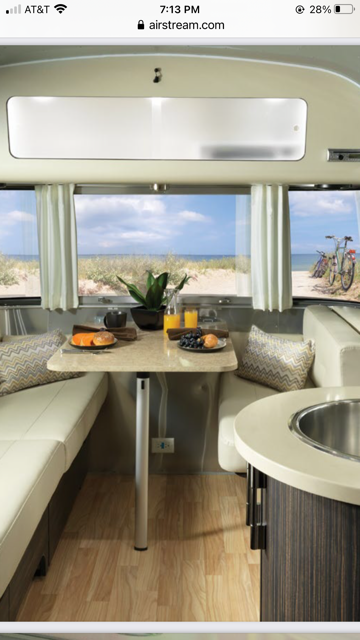
Where is `table`? This screenshot has height=640, width=360. table is located at coordinates (138, 356).